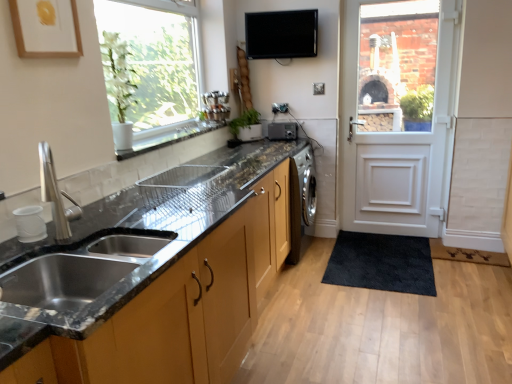
The height and width of the screenshot is (384, 512). What do you see at coordinates (168, 138) in the screenshot?
I see `white ceramic window sill at upper center` at bounding box center [168, 138].

Describe the element at coordinates (281, 34) in the screenshot. I see `black glossy tv at upper center, positioned as the 2th appliance in back-to-front order` at that location.

You are a GUI agent. You are given a task and a screenshot of the screen. Output one action in this format:
    pyautogui.click(x=<x>, y=<y>)
    Task: Click on the matte brown cabinets at lower left, which appears as the second cabinetry when viewed from the top
    
    Given the screenshot: What is the action you would take?
    pyautogui.click(x=190, y=305)

You are a GUI agent. You are given a task and a screenshot of the screen. Output one action in this format:
    pyautogui.click(x=<x>, y=<y>)
    Task: Click on the clear glass window at upper left
    The width and height of the screenshot is (512, 384).
    Given the screenshot: What is the action you would take?
    pyautogui.click(x=152, y=71)

Which is more to the left, white wooden door at right or satin silver washing machine at right, arranged as the second appliance when viewed from the front?

satin silver washing machine at right, arranged as the second appliance when viewed from the front, is more to the left.

From a real-world perspective, is white wooden door at right physically located above or below satin silver washing machine at right, arranged as the second appliance when viewed from the front?

In terms of real-world spatial position, white wooden door at right is above satin silver washing machine at right, arranged as the second appliance when viewed from the front.

The width and height of the screenshot is (512, 384). Identify the location of appliance below the white wooden door at right (from the image's perspective). (282, 131).

Does white wooden door at right come behind satin silver washing machine at right, the second appliance from the top?

No, white wooden door at right is closer to the camera.

Is white ceramic window sill at upper center taller or shorter than green matte plant at center?

In the image, white ceramic window sill at upper center appears to be shorter than green matte plant at center.

Considering the relative sizes of white ceramic window sill at upper center and green matte plant at center in the image provided, is white ceramic window sill at upper center thinner than green matte plant at center?

In fact, white ceramic window sill at upper center might be wider than green matte plant at center.

From the image's perspective, is white ceramic window sill at upper center above or below green matte plant at center?

From the image's perspective, white ceramic window sill at upper center appears below green matte plant at center.

From a real-world perspective, relative to white ceramic window sill at upper center, is matte black sink at lower left, arranged as the second cabinetry when ordered from the bottom, vertically above or below?

In terms of real-world spatial position, matte black sink at lower left, arranged as the second cabinetry when ordered from the bottom, is below white ceramic window sill at upper center.

Is matte black sink at lower left, which is counted as the 1th cabinetry, starting from the top, not within white ceramic window sill at upper center?

matte black sink at lower left, which is counted as the 1th cabinetry, starting from the top, is positioned outside white ceramic window sill at upper center.

Considering the relative sizes of matte black sink at lower left, arranged as the second cabinetry when ordered from the bottom, and white ceramic window sill at upper center in the image provided, is matte black sink at lower left, arranged as the second cabinetry when ordered from the bottom, taller than white ceramic window sill at upper center?

Yes, matte black sink at lower left, arranged as the second cabinetry when ordered from the bottom, is taller than white ceramic window sill at upper center.

This screenshot has height=384, width=512. I want to click on cabinetry located on the left of white ceramic window sill at upper center, so coord(152,334).

From the image's perspective, which is above, matte brown cabinets at lower left, which appears as the second cabinetry when viewed from the top, or satin silver washing machine at right, marked as the 1th appliance in a back-to-front arrangement?

satin silver washing machine at right, marked as the 1th appliance in a back-to-front arrangement.

From a real-world perspective, starting from the matte brown cabinets at lower left, acting as the first cabinetry starting from the bottom, which appliance is the 1st one vertically above it? Please provide its 2D coordinates.

[(282, 131)]

Are matte brown cabinets at lower left, acting as the first cabinetry starting from the bottom, and satin silver washing machine at right, arranged as the second appliance when viewed from the front, making contact?

matte brown cabinets at lower left, acting as the first cabinetry starting from the bottom, is not next to satin silver washing machine at right, arranged as the second appliance when viewed from the front, and they're not touching.

Between black glossy tv at upper center, positioned as the 2th appliance in back-to-front order, and dark brown textured mat at lower right, which one appears on the left side from the viewer's perspective?

black glossy tv at upper center, positioned as the 2th appliance in back-to-front order.

Consider the image. Is black glossy tv at upper center, marked as the 1th appliance in a top-to-bottom arrangement, oriented away from dark brown textured mat at lower right?

No, black glossy tv at upper center, marked as the 1th appliance in a top-to-bottom arrangement, is not facing the opposite direction of dark brown textured mat at lower right.

From the picture: Which of these two, black glossy tv at upper center, which is counted as the 1th appliance, starting from the front, or dark brown textured mat at lower right, is bigger?

Bigger between the two is black glossy tv at upper center, which is counted as the 1th appliance, starting from the front.

Are black glossy tv at upper center, positioned as the 2th appliance in back-to-front order, and dark brown textured mat at lower right making contact?

They are not placed beside each other.

Is dark brown textured mat at lower right wider than white ceramic window sill at upper center?

Yes.

What's the angular difference between dark brown textured mat at lower right and white ceramic window sill at upper center's facing directions?

90.7 degrees.

Which object is positioned more to the right, dark brown textured mat at lower right or white ceramic window sill at upper center?

dark brown textured mat at lower right.

From the image's perspective, is dark brown textured mat at lower right beneath white ceramic window sill at upper center?

Indeed, from the image's perspective, dark brown textured mat at lower right is shown beneath white ceramic window sill at upper center.

Which of these two, white wooden door at right or matte black sink at lower left, which is counted as the 1th cabinetry, starting from the top, is bigger?

With larger size is white wooden door at right.

Is white wooden door at right next to matte black sink at lower left, which is counted as the 1th cabinetry, starting from the top?

No, white wooden door at right is not making contact with matte black sink at lower left, which is counted as the 1th cabinetry, starting from the top.

Is white wooden door at right closer to the viewer compared to matte black sink at lower left, arranged as the second cabinetry when ordered from the bottom?

No, white wooden door at right is further to the viewer.

From a real-world perspective, which object rests below the other?

matte black sink at lower left, which is counted as the 1th cabinetry, starting from the top.

The height and width of the screenshot is (384, 512). In order to click on appliance directly beneath the white wooden door at right (from a real-world perspective) in this screenshot , I will do `click(282, 131)`.

Locate an element on the screen. plant behind the white ceramic window sill at upper center is located at coordinates (244, 121).

Based on their spatial positions, is dark brown textured mat at lower right or white ceramic window sill at upper center closer to green matte plant at center?

Among the two, white ceramic window sill at upper center is located nearer to green matte plant at center.

Considering their positions, is clear glass window at upper left positioned further to green matte plant at center than white wooden door at right?

white wooden door at right is positioned further to the anchor green matte plant at center.

Based on their spatial positions, is matte brown cabinets at lower left, which appears as the second cabinetry when viewed from the top, or clear glass window at upper left further from matte black sink at lower left, which is counted as the 1th cabinetry, starting from the top?

clear glass window at upper left.

Which object lies further to the anchor point matte brown cabinets at lower left, acting as the first cabinetry starting from the bottom, green matte plant at center or dark brown textured mat at lower right?

dark brown textured mat at lower right lies further to matte brown cabinets at lower left, acting as the first cabinetry starting from the bottom, than the other object.

When comparing their distances from black glossy tv at upper center, positioned as the 2th appliance in back-to-front order, does satin silver washing machine at right, the second appliance from the top, or white wooden door at right seem further?

white wooden door at right.

Considering their positions, is dark brown textured mat at lower right positioned closer to matte black sink at lower left, which is counted as the 1th cabinetry, starting from the top, than clear glass window at upper left?

clear glass window at upper left.

When comparing their distances from matte brown cabinets at lower left, acting as the first cabinetry starting from the bottom, does white ceramic window sill at upper center or black glossy tv at upper center, which is counted as the 1th appliance, starting from the front, seem further?

Among the two, black glossy tv at upper center, which is counted as the 1th appliance, starting from the front, is located further to matte brown cabinets at lower left, acting as the first cabinetry starting from the bottom.

Considering their positions, is matte brown cabinets at lower left, which appears as the second cabinetry when viewed from the top, positioned closer to green matte plant at center than white ceramic window sill at upper center?

Based on the image, white ceramic window sill at upper center appears to be nearer to green matte plant at center.

At what (x,y) coordinates should I click in order to perform the action: click on flat between matte black sink at lower left, which is counted as the 1th cabinetry, starting from the top, and white wooden door at right in the front-back direction. Please return your answer as a coordinate pair (x, y). This screenshot has width=512, height=384. Looking at the image, I should click on (467, 254).

Locate an element on the screen. appliance between matte black sink at lower left, arranged as the second cabinetry when ordered from the bottom, and satin silver washing machine at right, marked as the 1th appliance in a back-to-front arrangement, in the front-back direction is located at coordinates (281, 34).

Identify the location of cabinetry between matte brown cabinets at lower left, which appears as the second cabinetry when viewed from the top, and white wooden door at right in the front-back direction. This screenshot has width=512, height=384. (152, 334).

The image size is (512, 384). In order to click on plant between matte brown cabinets at lower left, acting as the first cabinetry starting from the bottom, and satin silver washing machine at right, the second appliance from the top, from front to back in this screenshot , I will do `click(244, 121)`.